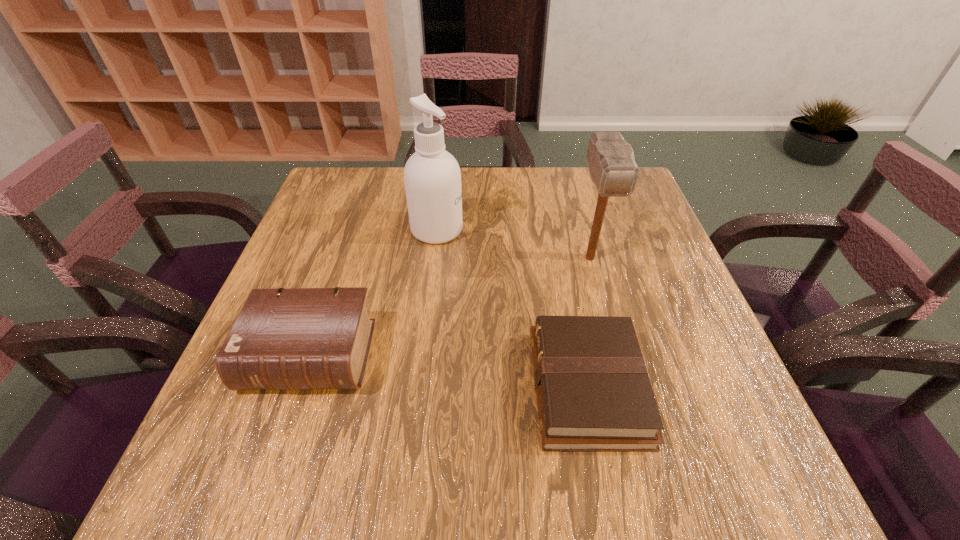
I want to click on cleansing agent, so click(x=432, y=177).

Find the location of a particular element. This screenshot has height=540, width=960. the third shortest object is located at coordinates (612, 166).

This screenshot has height=540, width=960. Find the location of `the taller Bible`. the taller Bible is located at coordinates (289, 338).

The image size is (960, 540). In order to click on the leftmost object in this screenshot , I will do `click(289, 338)`.

The image size is (960, 540). Find the location of `the shortest object`. the shortest object is located at coordinates (593, 391).

You are a GUI agent. You are given a task and a screenshot of the screen. Output one action in this format:
    pyautogui.click(x=<x>, y=<y>)
    Task: Click on the right Bible
    The height and width of the screenshot is (540, 960).
    Given the screenshot: What is the action you would take?
    [593, 391]

Find the location of a particular element. The image size is (960, 540). vacant space located on the front label of the cleansing agent is located at coordinates (522, 230).

You are a GUI agent. You are given a task and a screenshot of the screen. Output one action in this format:
    pyautogui.click(x=<x>, y=<y>)
    Task: Click on the vacant position located on the striking face of the mallet
    
    Given the screenshot: What is the action you would take?
    pyautogui.click(x=609, y=327)

Locate an element on the screen. The width and height of the screenshot is (960, 540). free space located on the spine side of the second shortest object is located at coordinates (261, 500).

Locate an element on the screen. This screenshot has height=540, width=960. vacant space located on the spine side of the right Bible is located at coordinates (417, 387).